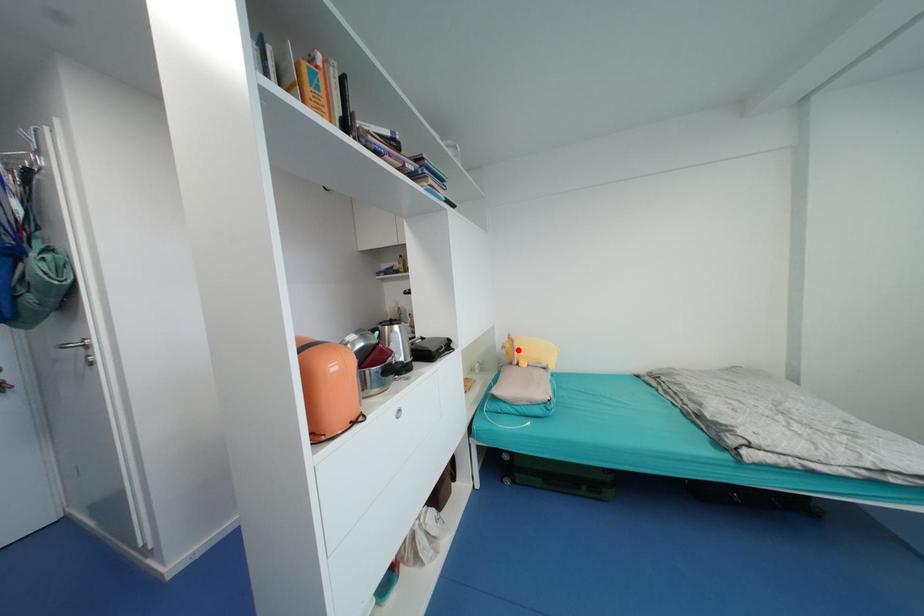
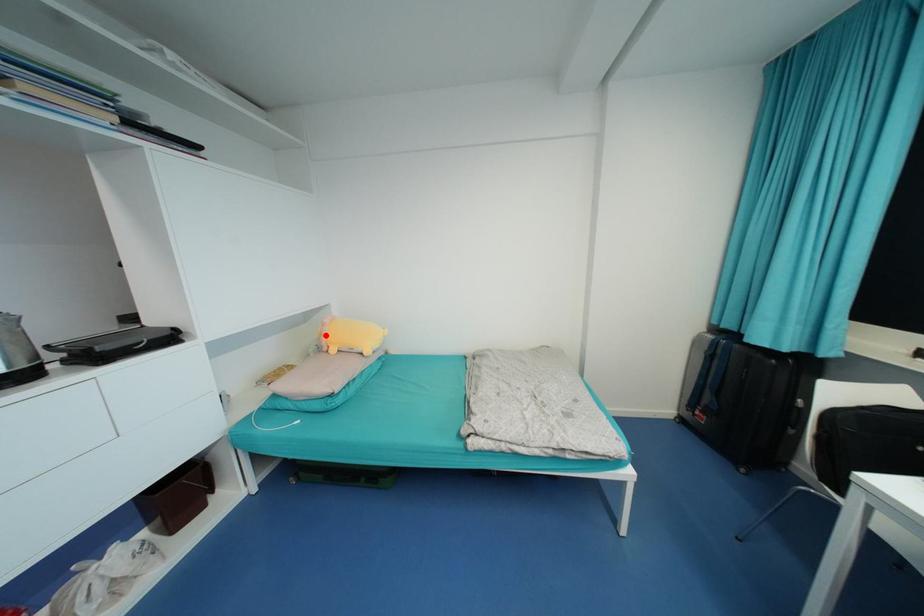
I am providing you with two images of the same scene from different viewpoints. A red point is marked on the first image and another point is marked on the second image. Is the red point in image1 aligned with the point shown in image2?

Yes